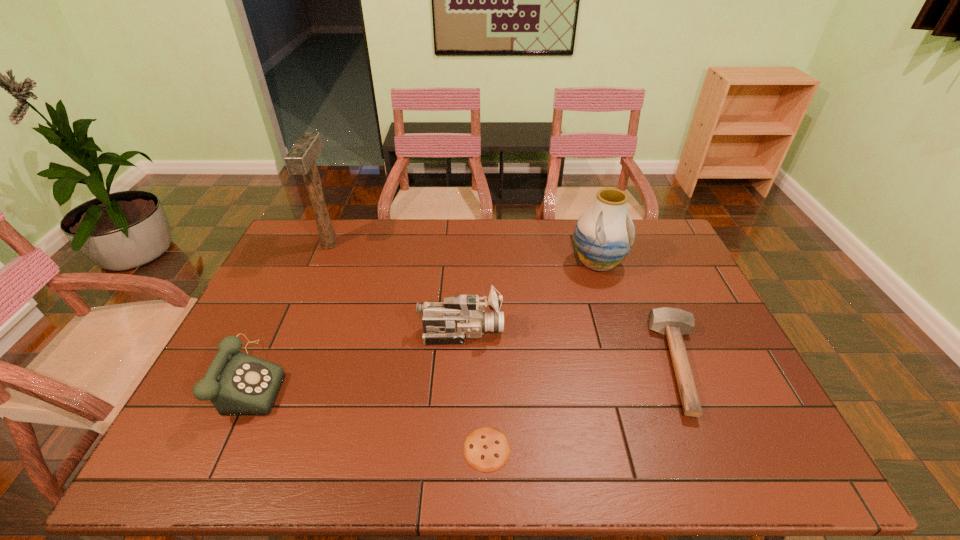
Locate an element on the screen. The image size is (960, 540). free spot that satisfies the following two spatial constraints: 1. on the front side of the left mallet; 2. on the left side of the cookie is located at coordinates coord(242,449).

Where is `vacant space that satisfies the following two spatial constraints: 1. on the back side of the second tallest object; 2. on the left side of the cookie`? The image size is (960, 540). vacant space that satisfies the following two spatial constraints: 1. on the back side of the second tallest object; 2. on the left side of the cookie is located at coordinates (485, 263).

You are a GUI agent. You are given a task and a screenshot of the screen. Output one action in this format:
    pyautogui.click(x=<x>, y=<y>)
    Task: Click on the vacant space that satisfies the following two spatial constraints: 1. on the front-facing side of the camcorder; 2. on the right side of the shortest object
    This screenshot has width=960, height=540.
    Given the screenshot: What is the action you would take?
    pyautogui.click(x=456, y=449)